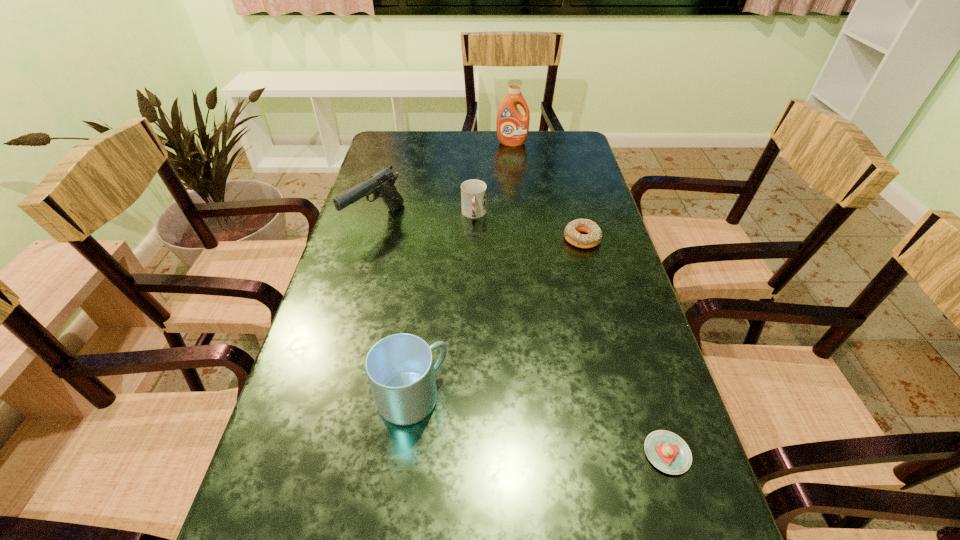
The height and width of the screenshot is (540, 960). Identify the location of free space located on the front-facing side of the detergent. (514, 163).

The width and height of the screenshot is (960, 540). I want to click on free space located 0.330m at the muzzle of the leftmost object, so click(342, 340).

This screenshot has height=540, width=960. What are the coordinates of `free spot located 0.290m on the right of the fifth farthest object` in the screenshot? It's located at (596, 397).

You are a GUI agent. You are given a task and a screenshot of the screen. Output one action in this format:
    pyautogui.click(x=<x>, y=<y>)
    Task: Click on the free spot located 0.390m on the side of the third object from left to right where the handle is located
    
    Given the screenshot: What is the action you would take?
    pyautogui.click(x=472, y=333)

This screenshot has height=540, width=960. What are the coordinates of `vacant space located 0.140m on the front of the doughnut` in the screenshot? It's located at (594, 289).

Locate an element on the screen. vacant space situated on the back of the nearest object is located at coordinates (619, 300).

At what (x,y) coordinates should I click in order to perform the action: click on object that is at the far edge. Please return your answer as a coordinate pair (x, y). Looking at the image, I should click on (512, 127).

Where is `object that is at the left edge`? object that is at the left edge is located at coordinates (381, 184).

Find the location of a particular element. The height and width of the screenshot is (540, 960). doughnut that is at the right edge is located at coordinates (571, 233).

Image resolution: width=960 pixels, height=540 pixels. What are the coordinates of `pastry that is at the right edge` in the screenshot? It's located at (668, 452).